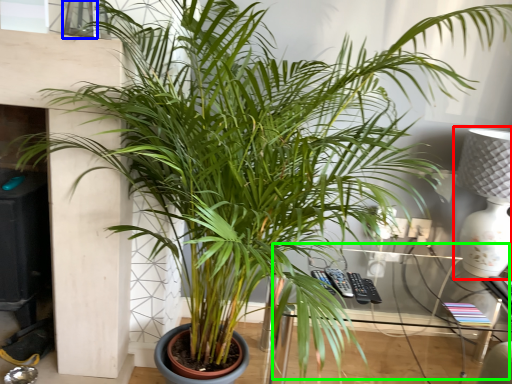
Question: Based on their relative distances, which object is nearer to table lamp (highlighted by a red box)? Choose from window (highlighted by a blue box) and table (highlighted by a green box).

Choices:
 (A) window
 (B) table

Answer: (B)